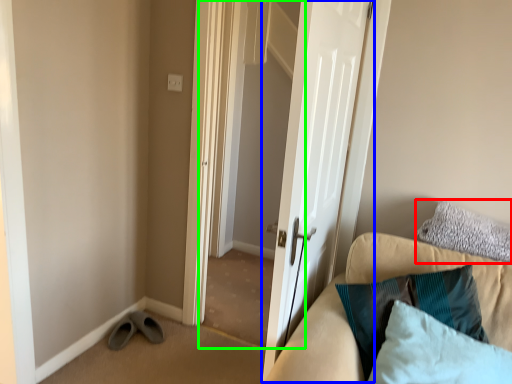
Question: Which object is positioned closest to pillow (highlighted by a red box)? Select from door (highlighted by a blue box) and screen door (highlighted by a green box).

Choices:
 (A) door
 (B) screen door

Answer: (A)